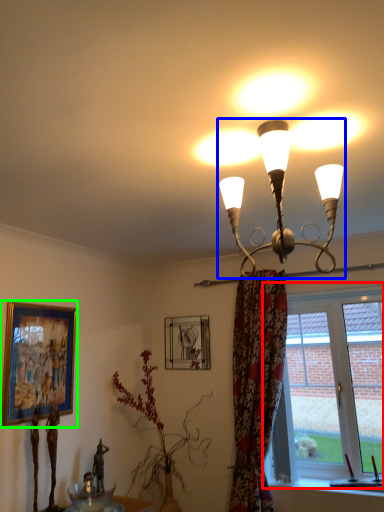
Question: Estimate the real-world distances between objects in this image. Which object is closer to window (highlighted by a red box), lamp (highlighted by a blue box) or picture frame (highlighted by a green box)?

Choices:
 (A) lamp
 (B) picture frame

Answer: (A)